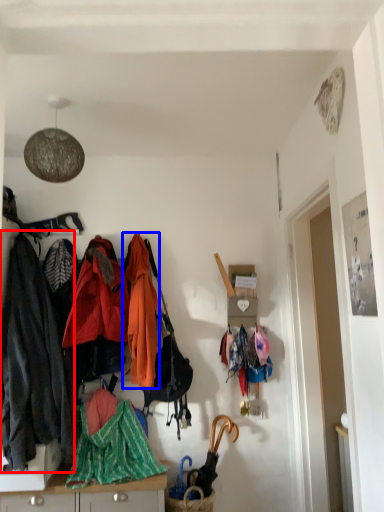
Question: Among these objects, which one is farthest to the camera, jacket (highlighted by a red box) or jacket (highlighted by a blue box)?

Choices:
 (A) jacket
 (B) jacket

Answer: (B)